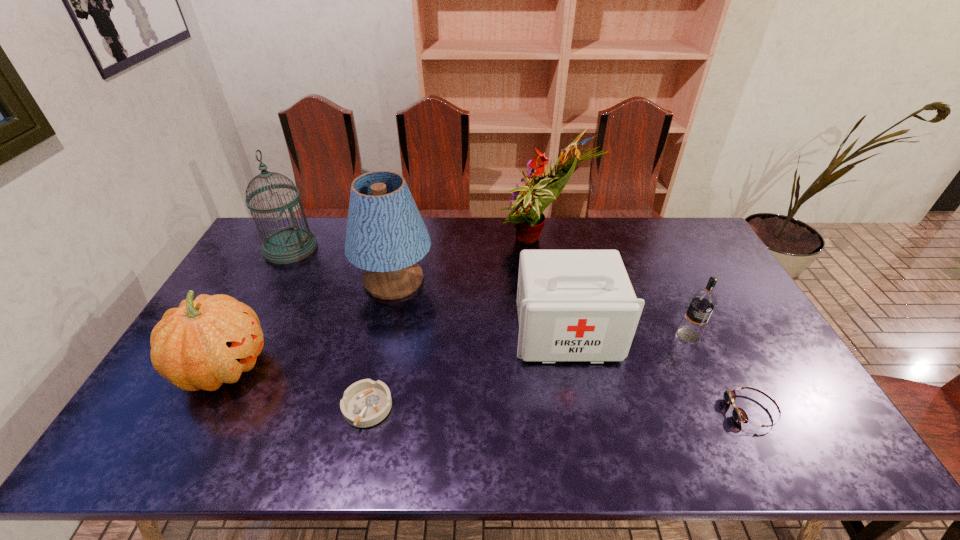
This screenshot has width=960, height=540. Find the location of `free space located on the front-facing side of the bouquet`. free space located on the front-facing side of the bouquet is located at coordinates (385, 243).

I want to click on vacant space located 0.130m on the front-facing side of the birdcage, so click(x=352, y=248).

You are a GUI agent. You are given a task and a screenshot of the screen. Output one action in this format:
    pyautogui.click(x=<x>, y=<y>)
    Task: Click on the free space located 0.330m on the right of the lampshade
    Image resolution: width=960 pixels, height=540 pixels.
    Given the screenshot: What is the action you would take?
    pyautogui.click(x=535, y=280)

The width and height of the screenshot is (960, 540). What are the coordinates of `vacant region located on the front-facing side of the first-aid kit` in the screenshot? It's located at (581, 407).

Image resolution: width=960 pixels, height=540 pixels. In order to click on vacant space located 0.300m on the carved face of the pumpkin in this screenshot , I will do `click(381, 367)`.

Locate an element on the screen. Image resolution: width=960 pixels, height=540 pixels. vacant space located 0.120m on the label of the sixth tallest object is located at coordinates (709, 380).

Find the location of a particular element. The width and height of the screenshot is (960, 540). vacant area located through the lenses of the goggles is located at coordinates (700, 410).

In order to click on vacant space located through the lenses of the goggles in this screenshot , I will do (643, 410).

The height and width of the screenshot is (540, 960). Identify the location of vacant area situated 0.200m through the lenses of the goggles. (647, 410).

At what (x,y) coordinates should I click in order to perform the action: click on vacant area situated on the front of the ashtray. Please return your answer as a coordinate pair (x, y). The height and width of the screenshot is (540, 960). Looking at the image, I should click on (358, 452).